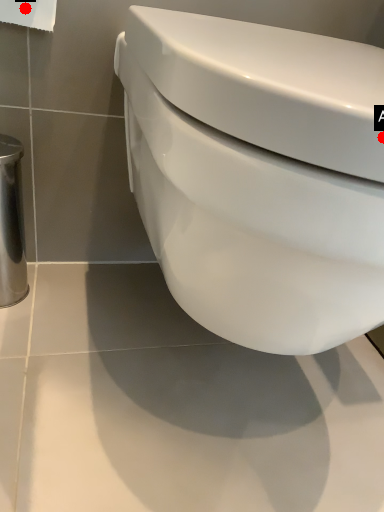
Question: Two points are circled on the image, labeled by A and B beside each circle. Which point is closer to the camera taking this photo?

Choices:
 (A) A is closer
 (B) B is closer

Answer: (A)